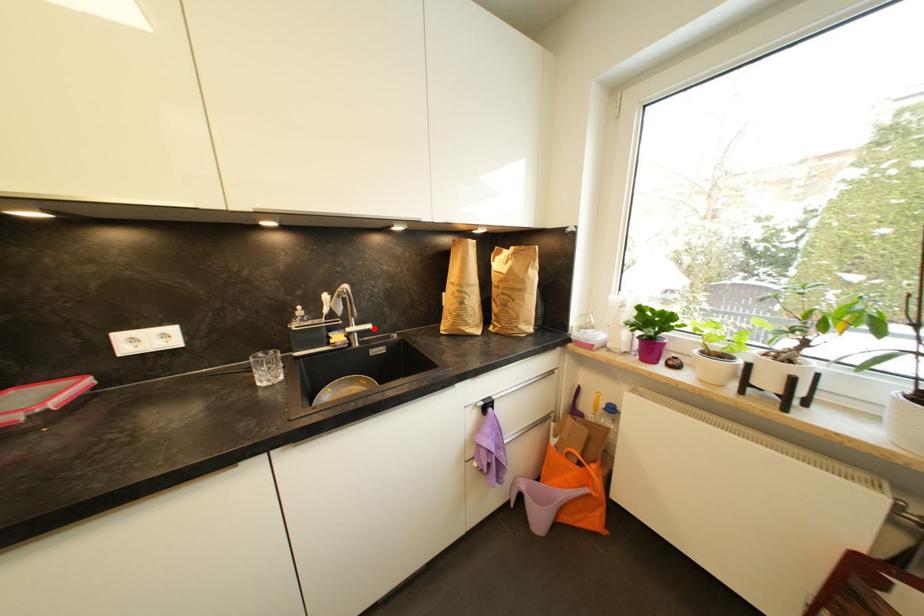
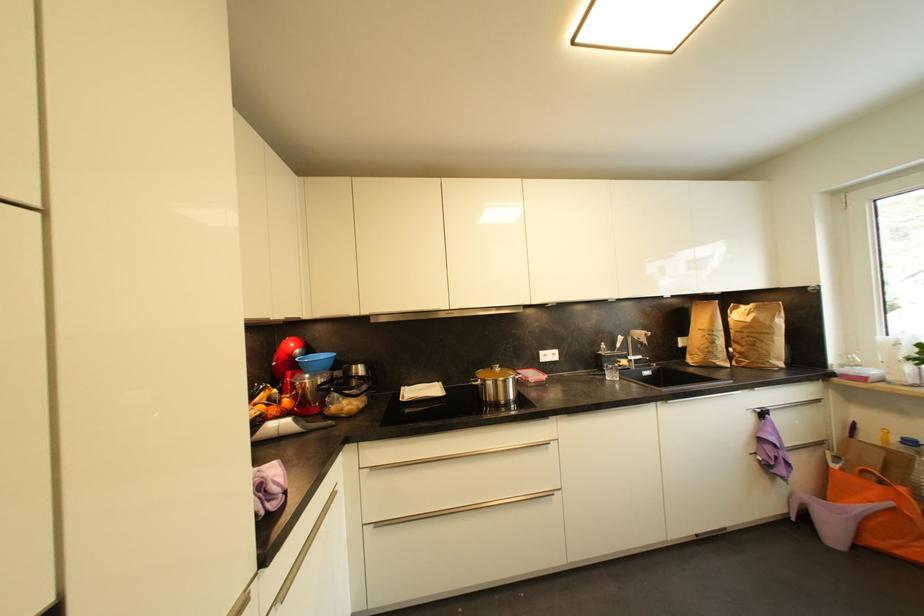
The point at the highlighted location is marked in the first image. Where is the corresponding point in the second image?

(645, 359)